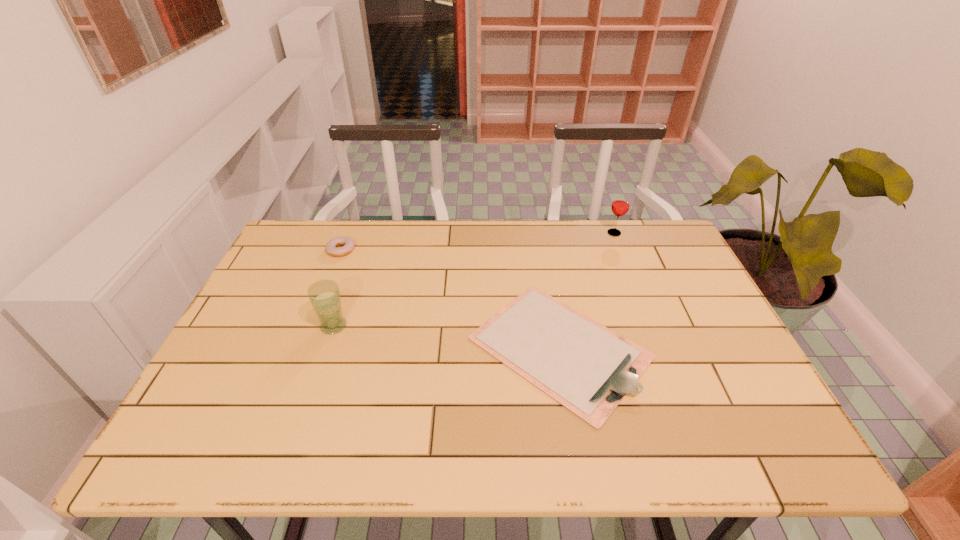
Where is `glass that is positioned at the far edge`? This screenshot has width=960, height=540. glass that is positioned at the far edge is located at coordinates (620, 205).

Image resolution: width=960 pixels, height=540 pixels. I want to click on doughnut positioned at the far edge, so click(x=347, y=243).

At what (x,y) coordinates should I click in order to perform the action: click on object positioned at the near edge. Please return your answer as a coordinate pair (x, y). The width and height of the screenshot is (960, 540). Looking at the image, I should click on (586, 367).

Where is `object present at the left edge`? The height and width of the screenshot is (540, 960). object present at the left edge is located at coordinates (347, 243).

You are a GUI agent. You are given a task and a screenshot of the screen. Output one action in this format:
    pyautogui.click(x=<x>, y=<y>)
    Task: Click on the object that is at the right edge
    This screenshot has width=960, height=540.
    Given the screenshot: What is the action you would take?
    pyautogui.click(x=620, y=205)

You are a GUI agent. You are given a task and a screenshot of the screen. Output one action in this format:
    pyautogui.click(x=<x>, y=<y>)
    Task: Click on the object positioned at the far left corner
    
    Given the screenshot: What is the action you would take?
    pyautogui.click(x=347, y=243)

The width and height of the screenshot is (960, 540). I want to click on object that is at the far right corner, so click(x=620, y=205).

Find the location of a particular element. vacant space at the far edge is located at coordinates (558, 244).

Image resolution: width=960 pixels, height=540 pixels. Find the location of `vacant point at the near edge`. vacant point at the near edge is located at coordinates (576, 429).

This screenshot has height=540, width=960. What are the coordinates of `vacant space at the right edge of the desktop` in the screenshot? It's located at (668, 290).